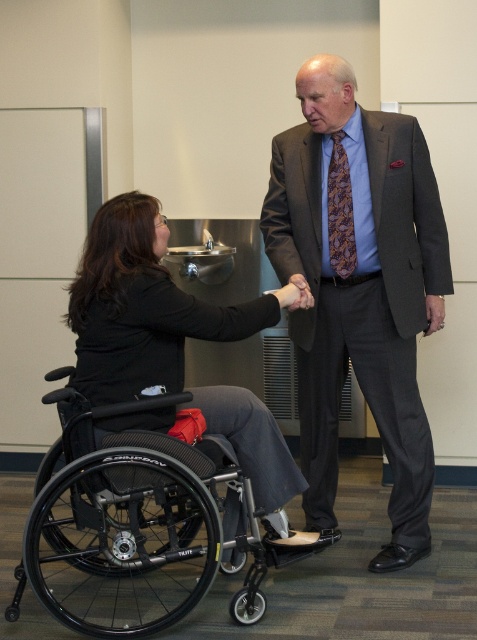
You are a photographer adjusting the framing of a portrait. The subjects are the person in the wheelchair and the formally dressed individual. You need to ensure that both the purple patterned tie at center and the matte black hand at center are clearly visible in the shot. Given their sizes, which object should you focus on to avoid cropping either of them?

The purple patterned tie at center has a larger width than the matte black hand at center, so you should focus on ensuring the purple patterned tie at center is fully visible to avoid cropping either object.

You are a photographer taking a picture of the two people in the scene. You notice the purple patterned tie at center and the matte black hand at center. Which object should you focus on first if you want to capture the person who is standing?

The purple patterned tie at center is above the matte black hand at center. Since the standing person is wearing the tie, focusing on the purple patterned tie at center ensures you capture the standing individual first.